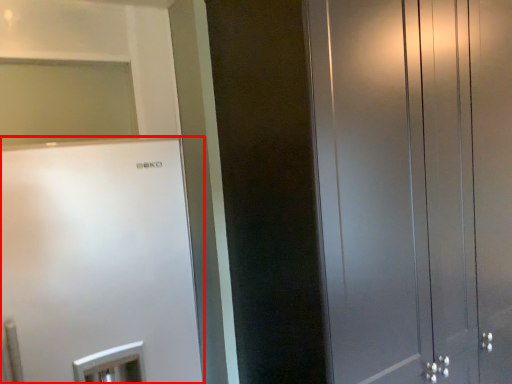
Question: From the image's perspective, what is the correct spatial positioning of refrigerator (annotated by the red box) in reference to door?

Choices:
 (A) above
 (B) below

Answer: (B)